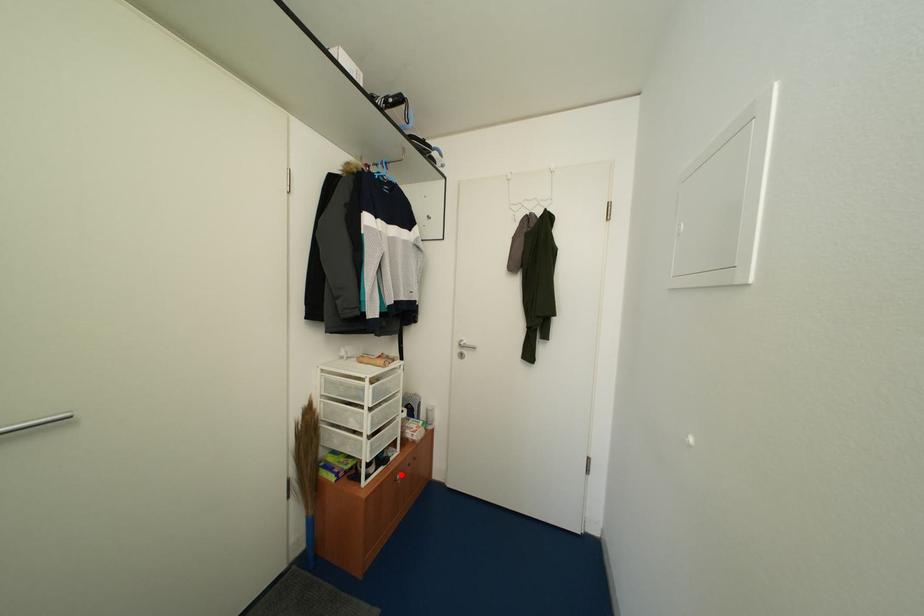
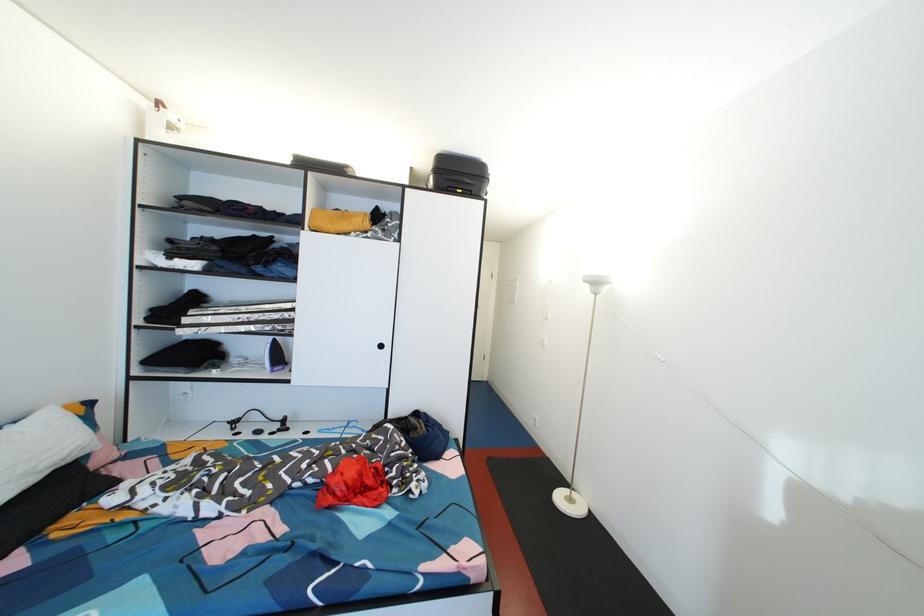
Question: I am providing you with two images of the same scene from different viewpoints. A red point is marked on the first image. At the location where the point appears in image 1, is it still visible in image 2?

Choices:
 (A) Yes
 (B) No

Answer: (B)